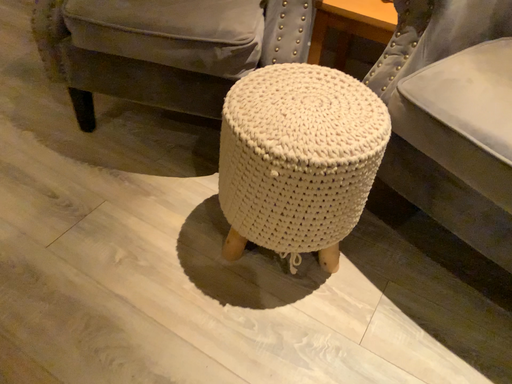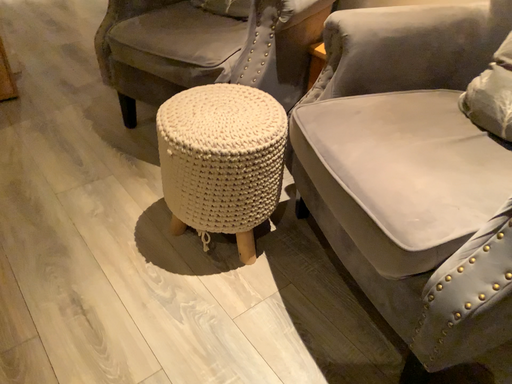
Question: Which way did the camera rotate in the video?

Choices:
 (A) rotated downward
 (B) rotated upward

Answer: (B)